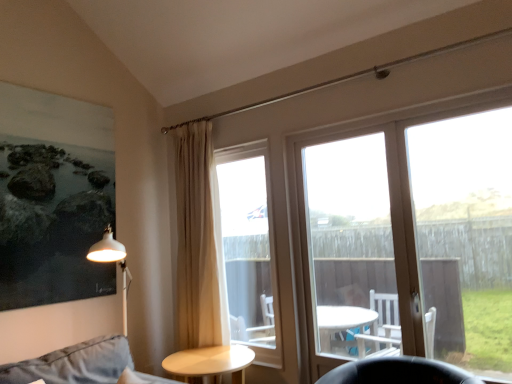
Question: From the image's perspective, is beige fabric curtain at center located beneath clear glass door at center right?

Choices:
 (A) yes
 (B) no

Answer: (A)

Question: Considering the relative sizes of beige fabric curtain at center and clear glass door at center right in the image provided, is beige fabric curtain at center shorter than clear glass door at center right?

Choices:
 (A) yes
 (B) no

Answer: (B)

Question: Is clear glass door at center right at the back of beige fabric curtain at center?

Choices:
 (A) no
 (B) yes

Answer: (A)

Question: From a real-world perspective, is beige fabric curtain at center physically above clear glass door at center right?

Choices:
 (A) no
 (B) yes

Answer: (B)

Question: Considering the relative positions of beige fabric curtain at center and clear glass door at center right in the image provided, is beige fabric curtain at center in front of clear glass door at center right?

Choices:
 (A) no
 (B) yes

Answer: (A)

Question: Would you say beige fabric curtain at center is inside or outside transparent glass door at upper right?

Choices:
 (A) outside
 (B) inside

Answer: (A)

Question: Would you say beige fabric curtain at center is to the left or to the right of transparent glass door at upper right in the picture?

Choices:
 (A) right
 (B) left

Answer: (B)

Question: In terms of width, does beige fabric curtain at center look wider or thinner when compared to transparent glass door at upper right?

Choices:
 (A) wide
 (B) thin

Answer: (A)

Question: From their relative heights in the image, would you say beige fabric curtain at center is taller or shorter than transparent glass door at upper right?

Choices:
 (A) tall
 (B) short

Answer: (A)

Question: Is transparent glass door at upper right to the left or to the right of clear glass door at center in the image?

Choices:
 (A) right
 (B) left

Answer: (A)

Question: From their relative heights in the image, would you say transparent glass door at upper right is taller or shorter than clear glass door at center?

Choices:
 (A) tall
 (B) short

Answer: (A)

Question: From the image's perspective, relative to clear glass door at center, is transparent glass door at upper right above or below?

Choices:
 (A) above
 (B) below

Answer: (A)

Question: Considering the positions of point (324, 144) and point (220, 163), is point (324, 144) closer or farther from the camera than point (220, 163)?

Choices:
 (A) closer
 (B) farther

Answer: (A)

Question: Do you think beige fabric curtain at center is within white glass door at center, or outside of it?

Choices:
 (A) outside
 (B) inside

Answer: (A)

Question: Considering the positions of point click(200, 163) and point click(301, 266), is point click(200, 163) closer or farther from the camera than point click(301, 266)?

Choices:
 (A) closer
 (B) farther

Answer: (B)